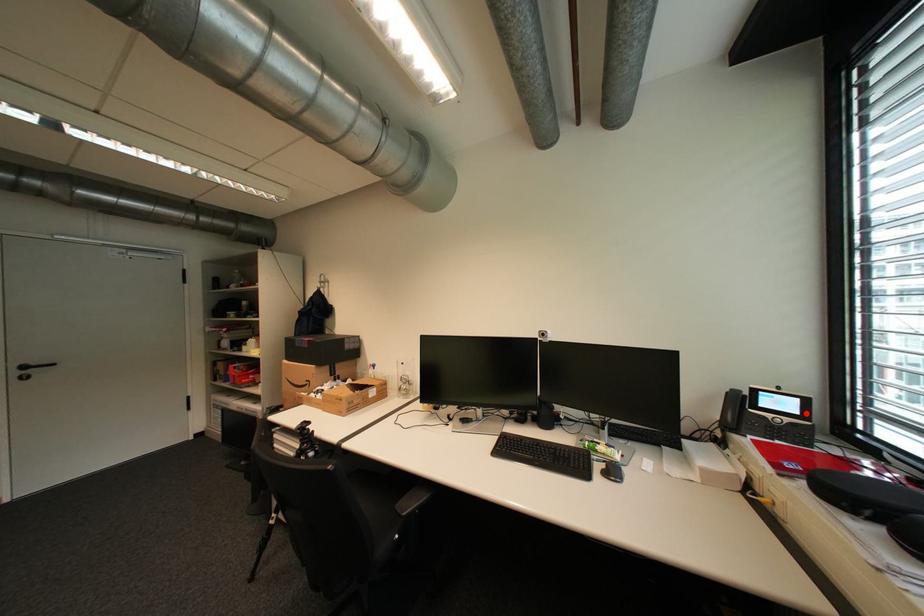
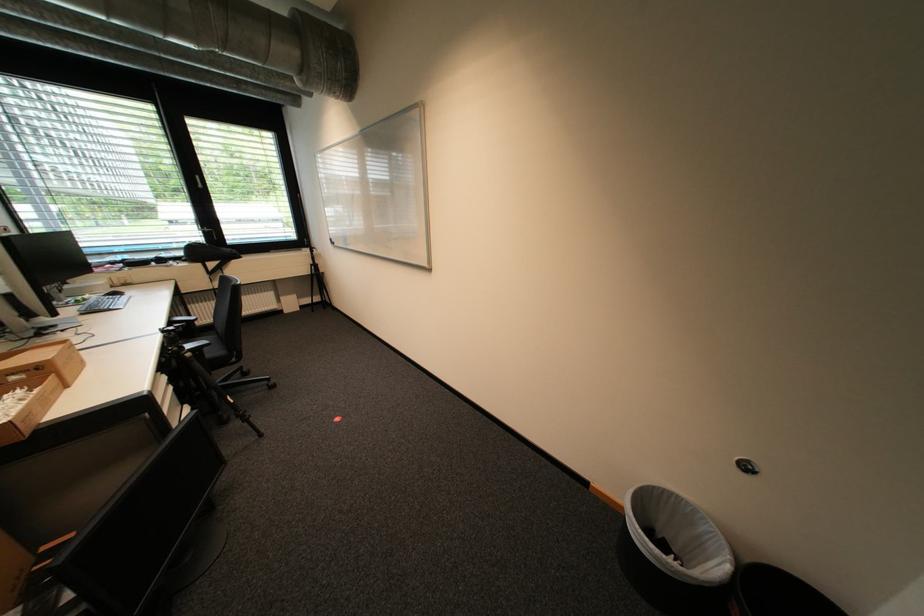
Question: I am providing you with two images of the same scene from different viewpoints. A red point is marked on the first image. Can you still see the location of the red point in image 2?

Choices:
 (A) Yes
 (B) No

Answer: (B)